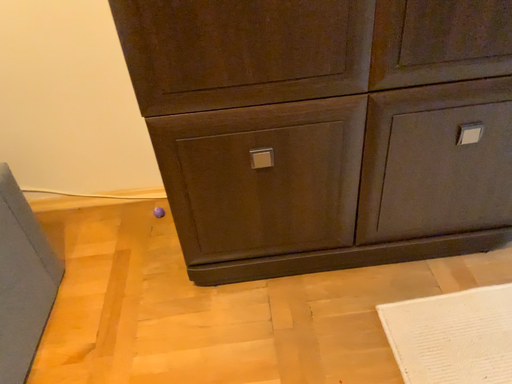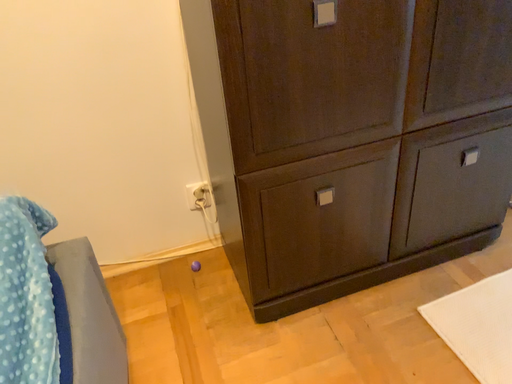
Question: Which way did the camera rotate in the video?

Choices:
 (A) rotated downward
 (B) rotated upward

Answer: (B)